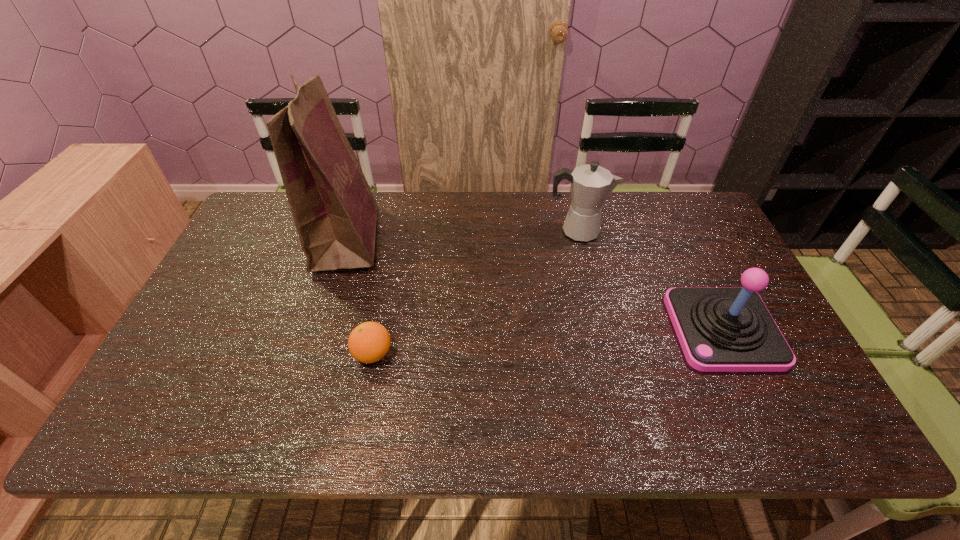
Identify which object is the second closest to the shortest object. Please provide its 2D coordinates. Your answer should be formatted as a tuple, i.e. [(x, y)], where the tuple contains the x and y coordinates of a point satisfying the conditions above.

[(591, 184)]

I want to click on vacant area that satisfies the following two spatial constraints: 1. on the front-facing side of the tallest object; 2. on the right side of the orange, so click(310, 354).

Where is `free space in the image that satisfies the following two spatial constraints: 1. on the back side of the orange; 2. on the front-facing side of the grocery bag`? This screenshot has width=960, height=540. free space in the image that satisfies the following two spatial constraints: 1. on the back side of the orange; 2. on the front-facing side of the grocery bag is located at coordinates (396, 239).

I want to click on vacant space that satisfies the following two spatial constraints: 1. on the front-facing side of the shortest object; 2. on the right side of the tallest object, so click(310, 354).